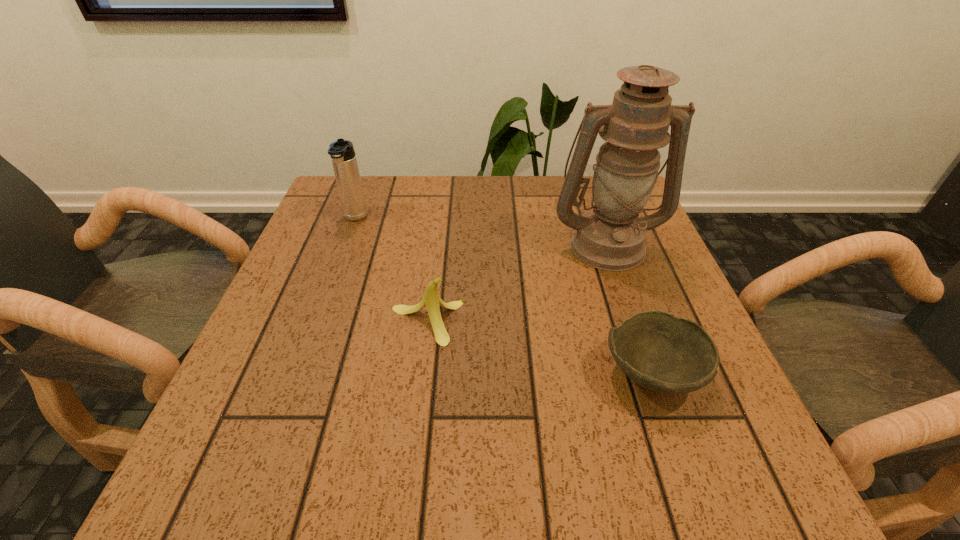
I want to click on empty space that is in between the leftmost object and the shortest object, so click(x=503, y=296).

This screenshot has height=540, width=960. What are the coordinates of `unoccupied position between the oil lamp and the second tallest object` in the screenshot? It's located at (481, 232).

Identify which object is the third nearest to the banana. Please provide its 2D coordinates. Your answer should be formatted as a tuple, i.e. [(x, y)], where the tuple contains the x and y coordinates of a point satisfying the conditions above.

[(344, 161)]

Find the location of a particular element. The height and width of the screenshot is (540, 960). the second closest object to the banana is located at coordinates (659, 351).

Locate an element on the screen. Image resolution: width=960 pixels, height=540 pixels. vacant position in the image that satisfies the following two spatial constraints: 1. on the handle side of the thermos bottle; 2. on the right side of the oil lamp is located at coordinates (346, 245).

At what (x,y) coordinates should I click in order to perform the action: click on vacant area in the image that satisfies the following two spatial constraints: 1. on the handle side of the leftmost object; 2. on the left side of the second shortest object. Please return your answer as a coordinate pair (x, y). The height and width of the screenshot is (540, 960). Looking at the image, I should click on (317, 322).

Find the location of a particular element. vacant region that satisfies the following two spatial constraints: 1. on the handle side of the third shortest object; 2. on the left side of the shortest object is located at coordinates (299, 373).

This screenshot has width=960, height=540. In order to click on free location that satisfies the following two spatial constraints: 1. on the front side of the banana; 2. on the right side of the shortest object in this screenshot , I will do `click(421, 373)`.

At what (x,y) coordinates should I click in order to perform the action: click on free region that satisfies the following two spatial constraints: 1. on the back side of the tallest object; 2. on the left side of the banana. Please return your answer as a coordinate pair (x, y). Image resolution: width=960 pixels, height=540 pixels. Looking at the image, I should click on (437, 245).

The image size is (960, 540). What are the coordinates of `free space that satisfies the following two spatial constraints: 1. on the handle side of the tallest object; 2. on the left side of the leftmost object` in the screenshot? It's located at (346, 245).